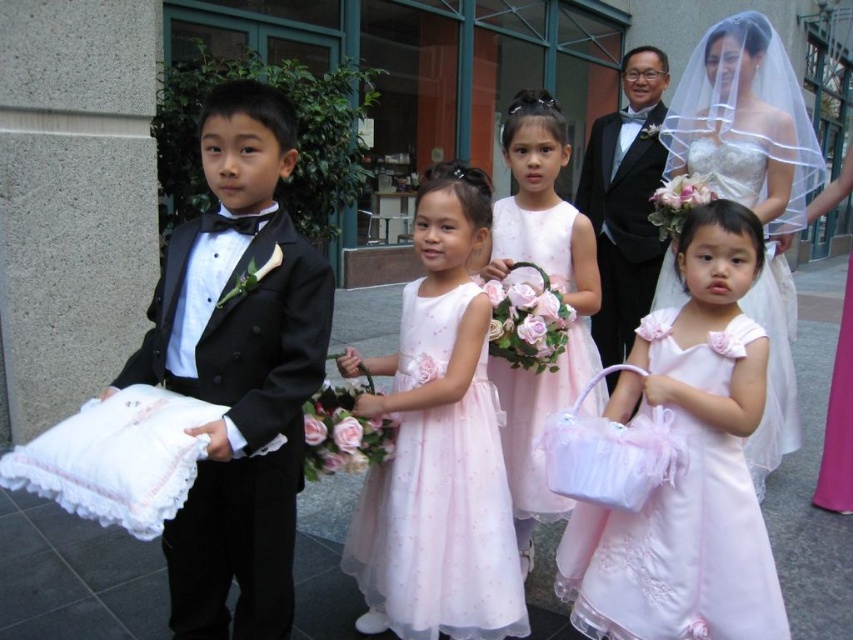
You are a photographer positioned at the front of the scene. You need to adjust your focus to capture both the satin white dress at upper center and the black satin tuxedo at center. Which one should you focus on first to ensure it appears sharp in the photo?

The satin white dress at upper center is closer to the viewer than the black satin tuxedo at center, so you should focus on the satin white dress at upper center first to ensure it is sharp. Adjusting focus for closer objects first helps maintain clarity in the foreground before considering background elements.

You are a photographer positioned at the center of the scene. You need to adjust your camera to focus on the pink satin dress at lower right. Based on its coordinates, which direction should you move your camera to ensure it is centered in your view?

The pink satin dress at lower right is located at point 0.794 on the x and 0.800 on the y axis. To center it, move the camera slightly to the right and up.